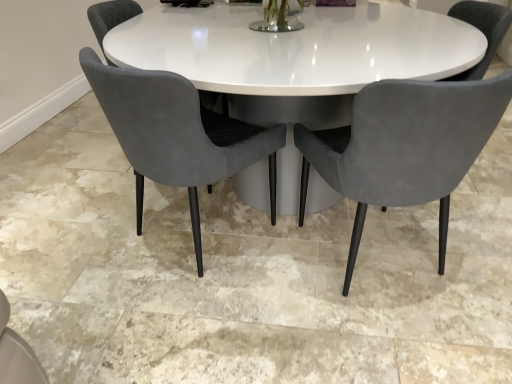
You are a GUI agent. You are given a task and a screenshot of the screen. Output one action in this format:
    pyautogui.click(x=<x>, y=<y>)
    Task: Click on the vacant space that's between velvet grey chair at center, the 2th chair when ordered from left to right, and velvet grey chair at center, the 3th chair positioned from the left
    Image resolution: width=512 pixels, height=384 pixels.
    Given the screenshot: What is the action you would take?
    pyautogui.click(x=279, y=273)